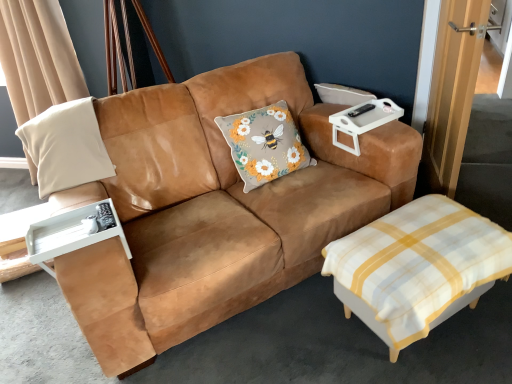
The width and height of the screenshot is (512, 384). I want to click on empty space that is ontop of white checkered ottoman at lower right (from a real-world perspective), so click(x=412, y=243).